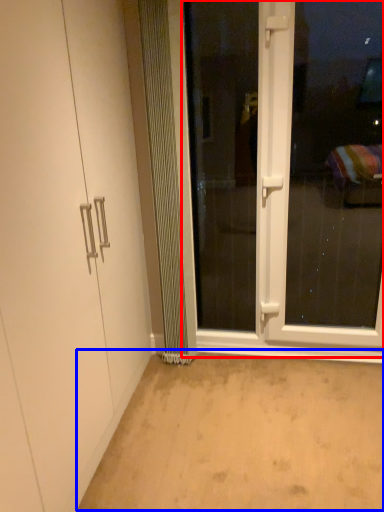
Question: Among these objects, which one is farthest to the camera, screen door (highlighted by a red box) or plain (highlighted by a blue box)?

Choices:
 (A) screen door
 (B) plain

Answer: (A)